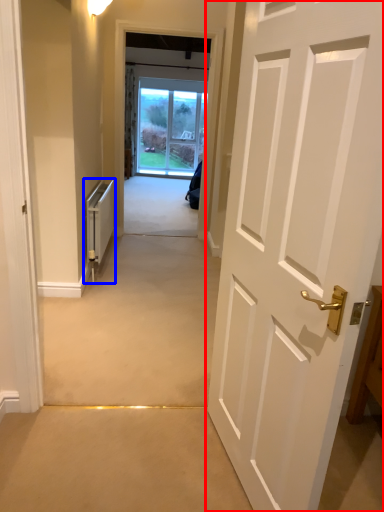
Question: Which of the following is the farthest to the observer, door (highlighted by a red box) or appliance (highlighted by a blue box)?

Choices:
 (A) door
 (B) appliance

Answer: (B)